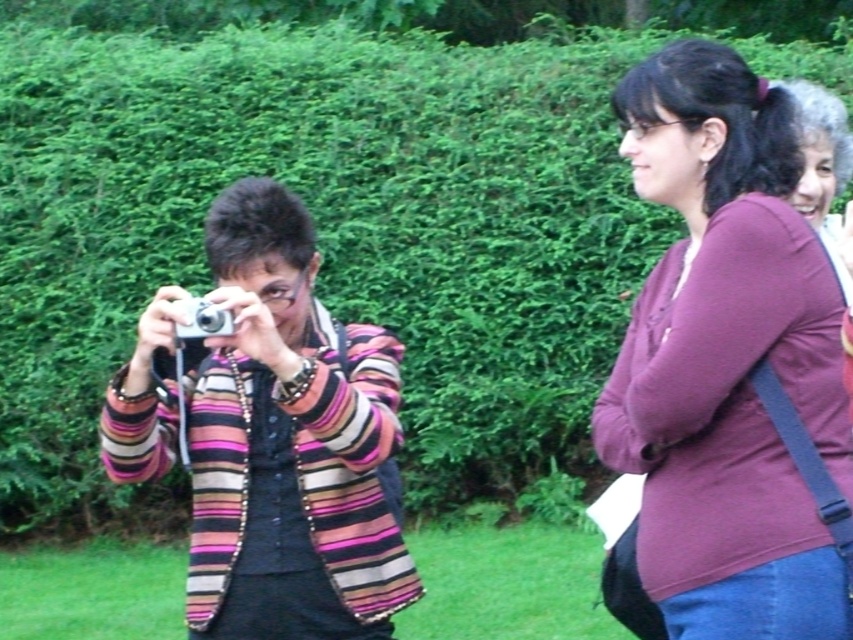
You are organizing a photography exhibition and need to display the striped fabric camera at center and the maroon fabric shirt at right in a row. If you want to arrange them from smallest to largest, which order should you place them?

The striped fabric camera at center is smaller than the maroon fabric shirt at right, so you should place the striped fabric camera at center first, followed by the maroon fabric shirt at right.

You are a photographer trying to set up your striped fabric camera at center and maroon fabric shirt at right in a way that they are both visible in your shot. Based on their positions, which object should you focus on first to ensure both are in frame?

The striped fabric camera at center is below the maroon fabric shirt at right, so you should focus on the maroon fabric shirt at right first to ensure both are in frame.

You are a photographer trying to set up a tripod between the striped fabric camera at center and the maroon fabric shirt at right. Since the tripod requires a space of at least 1 meter between the two objects, can you determine if there is enough space?

The striped fabric camera at center is to the left of maroon fabric shirt at right, but the distance between them is not specified in the provided information. Therefore, it is impossible to determine if the space is sufficient for the tripod.